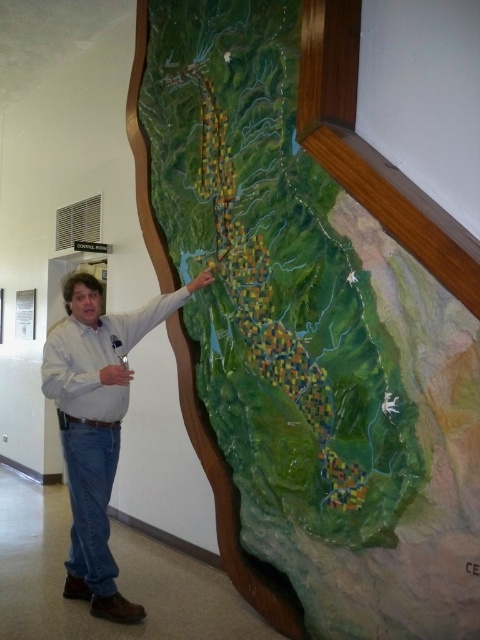
You are observing a man pointing at a map. According to the scene, where is the green textured map at center in relation to the denim jeans at center?

The green textured map at center is to the right of denim jeans at center.

You are observing a man standing in a room. He is pointing at the green textured map at center while wearing denim jeans at center. Is the map positioned higher than his clothing?

The green textured map at center is above denim jeans at center, so yes, the map is positioned higher than his clothing.

You are a visitor in the room and want to know which object is taller between the green textured map at center and the denim jeans at center. Based on the scene, can you determine which one is taller?

The green textured map at center is much taller as denim jeans at center, so the map is taller than the denim jeans at center.